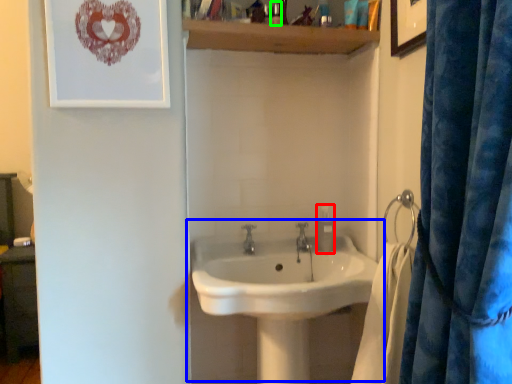
Question: Estimate the real-world distances between objects in this image. Which object is farther from soap dispenser (highlighted by a red box), sink (highlighted by a blue box) or toiletry (highlighted by a green box)?

Choices:
 (A) sink
 (B) toiletry

Answer: (B)